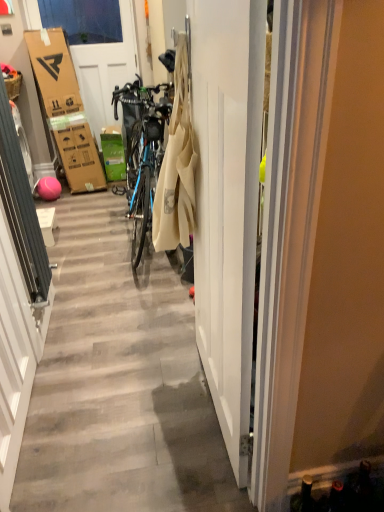
Question: Is matte blue bicycle at center taller than white glossy door at center, the first door positioned from the front?

Choices:
 (A) no
 (B) yes

Answer: (B)

Question: Considering the relative positions of matte blue bicycle at center and white glossy door at center, arranged as the 1th door when ordered from the bottom, in the image provided, is matte blue bicycle at center in front of white glossy door at center, arranged as the 1th door when ordered from the bottom,?

Choices:
 (A) no
 (B) yes

Answer: (B)

Question: Is matte blue bicycle at center not inside white glossy door at center, the 2th door viewed from the top?

Choices:
 (A) yes
 (B) no

Answer: (A)

Question: Could white glossy door at center, which is the 2th door in left-to-right order, be considered to be inside matte blue bicycle at center?

Choices:
 (A) no
 (B) yes

Answer: (A)

Question: Considering the relative positions of matte blue bicycle at center and white glossy door at center, which is counted as the 2th door, starting from the back, in the image provided, is matte blue bicycle at center to the right of white glossy door at center, which is counted as the 2th door, starting from the back, from the viewer's perspective?

Choices:
 (A) yes
 (B) no

Answer: (B)

Question: Is matte blue bicycle at center wider or thinner than white glossy door at center, marked as the first door in a right-to-left arrangement?

Choices:
 (A) thin
 (B) wide

Answer: (B)

Question: Is matte blue bicycle at center bigger or smaller than white glossy door at center, the first door positioned from the front?

Choices:
 (A) big
 (B) small

Answer: (A)

Question: From a real-world perspective, is matte blue bicycle at center positioned above or below white glossy door at center, which is counted as the 2th door, starting from the back?

Choices:
 (A) below
 (B) above

Answer: (A)

Question: Which is correct: matte blue bicycle at center is inside white glossy door at center, arranged as the 1th door when ordered from the bottom, or outside of it?

Choices:
 (A) outside
 (B) inside

Answer: (A)

Question: From their relative heights in the image, would you say white glossy door at center, the first door positioned from the front, is taller or shorter than matte blue bicycle at center?

Choices:
 (A) short
 (B) tall

Answer: (A)

Question: Is point [240, 242] closer or farther from the camera than point [223, 481]?

Choices:
 (A) farther
 (B) closer

Answer: (B)

Question: Is white glossy door at center, arranged as the 1th door when ordered from the bottom, inside the boundaries of matte blue bicycle at center, or outside?

Choices:
 (A) outside
 (B) inside

Answer: (A)

Question: Based on their sizes in the image, would you say white glossy door at center, the first door positioned from the front, is bigger or smaller than matte blue bicycle at center?

Choices:
 (A) small
 (B) big

Answer: (A)

Question: In terms of height, does white glossy door at center, which is counted as the 2th door, starting from the back, look taller or shorter compared to matte brown picnic basket at left?

Choices:
 (A) tall
 (B) short

Answer: (A)

Question: In terms of size, does white glossy door at center, the first door positioned from the front, appear bigger or smaller than matte brown picnic basket at left?

Choices:
 (A) small
 (B) big

Answer: (B)